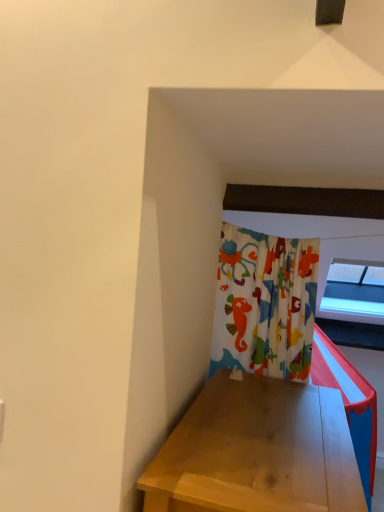
The height and width of the screenshot is (512, 384). I want to click on transparent plastic window at upper right, so click(353, 294).

This screenshot has width=384, height=512. What do you see at coordinates (353, 294) in the screenshot?
I see `transparent plastic window at upper right` at bounding box center [353, 294].

What is the approximate width of transparent plastic window at upper right?

The width of transparent plastic window at upper right is 35.37 inches.

At what (x,y) coordinates should I click in order to perform the action: click on transparent plastic window at upper right. Please return your answer as a coordinate pair (x, y). The image size is (384, 512). Looking at the image, I should click on (353, 294).